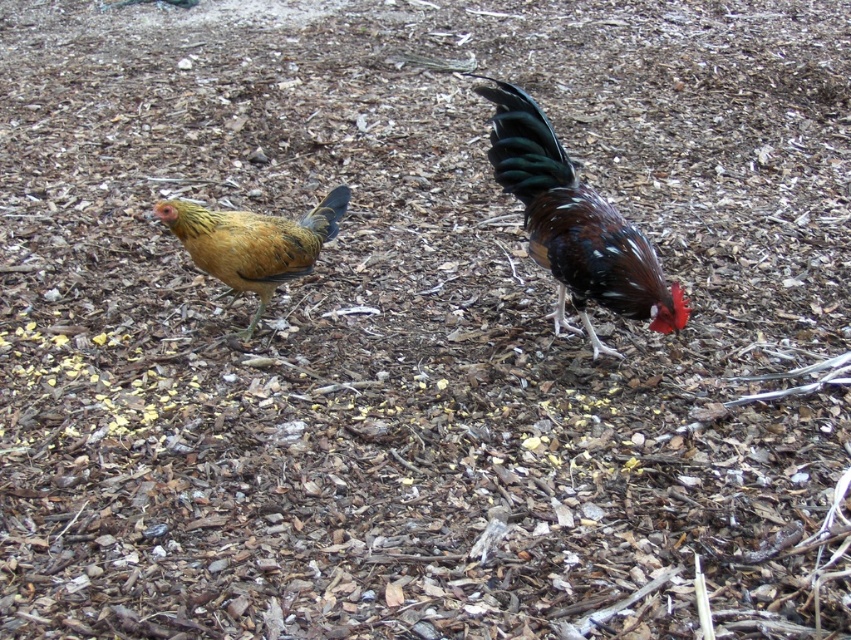
Is shiny brown rooster at right to the right of golden-yellow feathers at left from the viewer's perspective?

Correct, you'll find shiny brown rooster at right to the right of golden-yellow feathers at left.

Between point (495, 88) and point (208, 216), which one is positioned behind?

Positioned behind is point (495, 88).

Between point (523, 129) and point (208, 273), which one is positioned in front?

Point (523, 129) is in front.

Locate an element on the screen. The image size is (851, 640). shiny brown rooster at right is located at coordinates (574, 225).